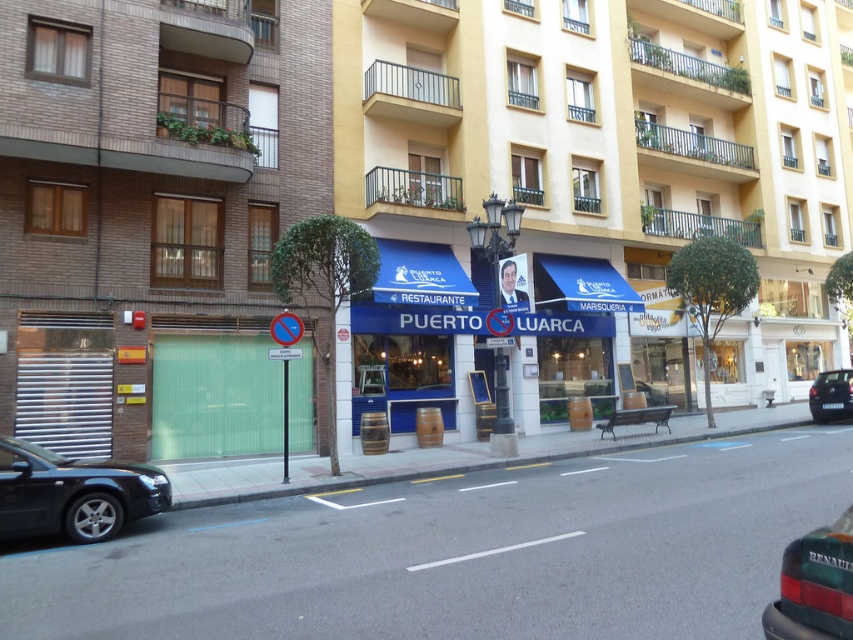
You are standing at the entrance of the restaurant and want to take a photo that includes both the point at coordinate point (827, 563) and the point at coordinate point (844, 406). Which point should you focus on first to ensure both are in focus?

You should focus on point (844, 406) first because it is farther from the camera than point (827, 563). By focusing on the farther point, both points will be in focus due to the depth of field.

You are standing on the sidewalk in front of the Puerto Luarca restaurant. The awning is important for identifying the restaurant. Can you tell me the exact coordinates of the blue painted wooden awning at center?

The blue painted wooden awning at center is located at point (x=419, y=336).

You are a pedestrian standing on the sidewalk in front of the Puerto Luarca restaurant. You need to cross the street to reach the park on the other side. There are two cars parked at the lower right corner of your view. Which car should you wait behind to safely cross the street first, the green matte car at lower right or the black metallic car at lower right?

You should wait behind the black metallic car at lower right because the green matte car at lower right is positioned to its left, meaning the black metallic car is closer to the street edge. This placement suggests the black metallic car is nearer to the curb, so waiting behind it would provide a safer crossing point.